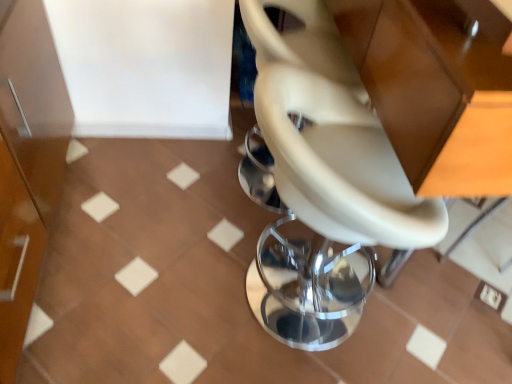
This screenshot has height=384, width=512. Find the location of `free space underneath white glossy toilet at center (from a real-world perspective)`. free space underneath white glossy toilet at center (from a real-world perspective) is located at coordinates (282, 293).